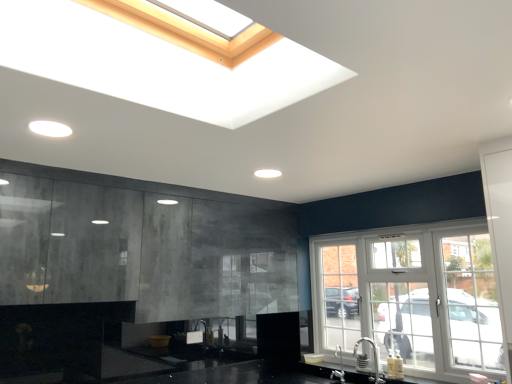
Question: Is point click(x=156, y=291) closer or farther from the camera than point click(x=369, y=299)?

Choices:
 (A) farther
 (B) closer

Answer: (B)

Question: From the image's perspective, is matte concrete cabinets at left above or below white glass window at right?

Choices:
 (A) above
 (B) below

Answer: (A)

Question: Which object is the farthest from the satin nickel faucet at lower center, which ranks as the second faucet in back-to-front order?

Choices:
 (A) matte concrete cabinets at left
 (B) white glass window at right
 (C) silver metallic faucet at lower right, the 2th faucet when ordered from front to back

Answer: (A)

Question: Which is nearer to the silver metallic faucet at lower right, which appears as the first faucet when viewed from the back?

Choices:
 (A) matte concrete cabinets at left
 (B) white glass window at right
 (C) satin nickel faucet at lower center, the first faucet positioned from the front

Answer: (C)